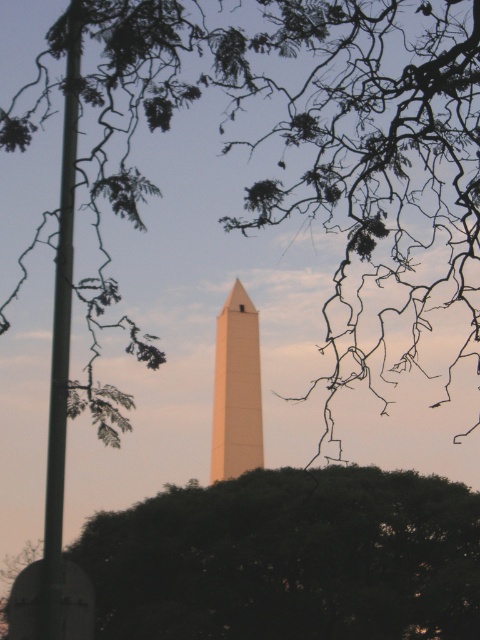
Does green leafy tree at upper center have a lesser height compared to green leafy tree at center?

No, green leafy tree at upper center is not shorter than green leafy tree at center.

Can you confirm if green leafy tree at upper center is positioned to the right of green leafy tree at center?

Indeed, green leafy tree at upper center is positioned on the right side of green leafy tree at center.

Locate an element on the screen. The width and height of the screenshot is (480, 640). green leafy tree at upper center is located at coordinates (324, 140).

Which is more to the left, green leafy tree at upper center or smooth beige obelisk at center?

smooth beige obelisk at center

This screenshot has width=480, height=640. Find the location of `green leafy tree at upper center`. green leafy tree at upper center is located at coordinates (324, 140).

This screenshot has height=640, width=480. Identify the location of green leafy tree at upper center. (324, 140).

Does green leafy tree at center have a lesser width compared to smooth beige obelisk at center?

Correct, green leafy tree at center's width is less than smooth beige obelisk at center's.

Between green leafy tree at center and smooth beige obelisk at center, which one has more height?

Standing taller between the two is smooth beige obelisk at center.

Between point (104, 516) and point (220, 403), which one is positioned in front?

Positioned in front is point (104, 516).

Locate an element on the screen. green leafy tree at center is located at coordinates (289, 557).